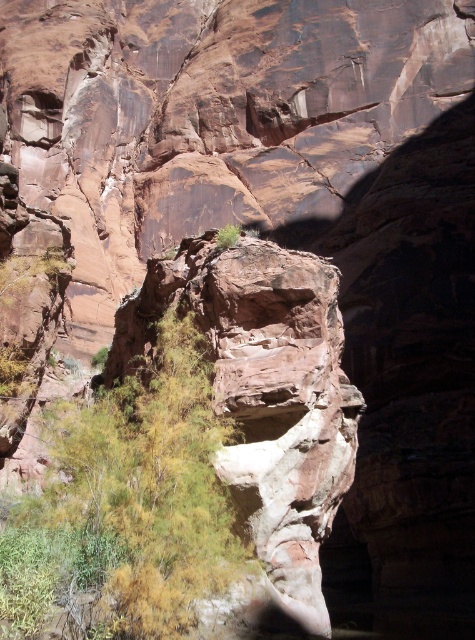
Question: Which object appears closest to the camera in this image?

Choices:
 (A) rustic stone cliff at center
 (B) green leafy shrub at center

Answer: (B)

Question: Does rustic stone cliff at center have a smaller size compared to green leafy shrub at center?

Choices:
 (A) yes
 (B) no

Answer: (B)

Question: Is rustic stone cliff at center further to camera compared to green leafy shrub at center?

Choices:
 (A) yes
 (B) no

Answer: (A)

Question: Which object is farther from the camera taking this photo?

Choices:
 (A) green leafy shrub at center
 (B) rustic stone cliff at center

Answer: (B)

Question: Does rustic stone cliff at center lie in front of green leafy shrub at center?

Choices:
 (A) yes
 (B) no

Answer: (B)